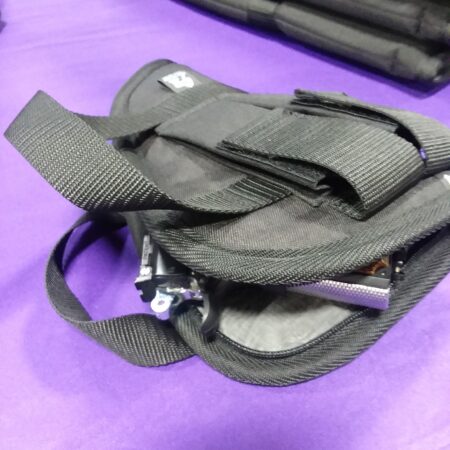
This screenshot has width=450, height=450. I want to click on side folded grey cloth, so click(x=377, y=18), click(x=314, y=27), click(x=368, y=45).